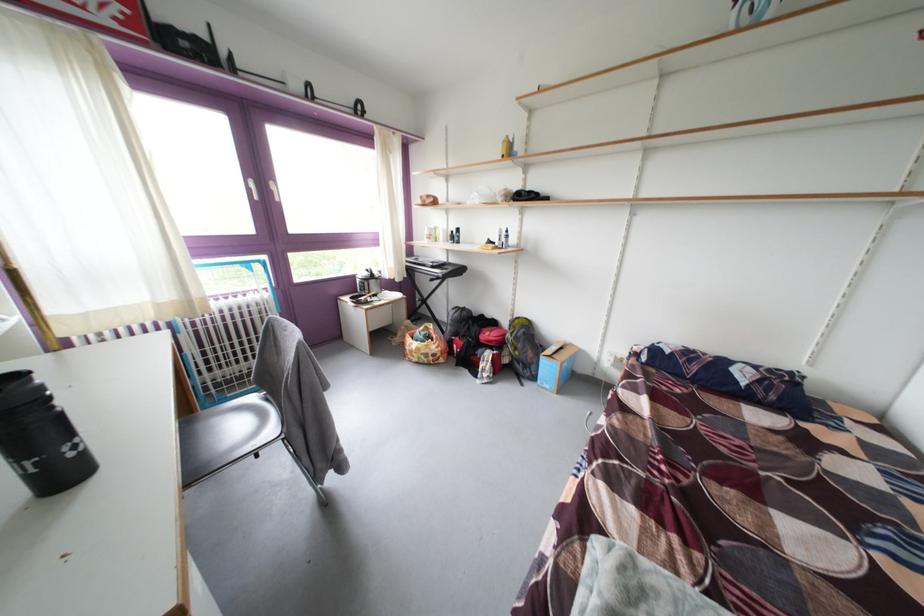
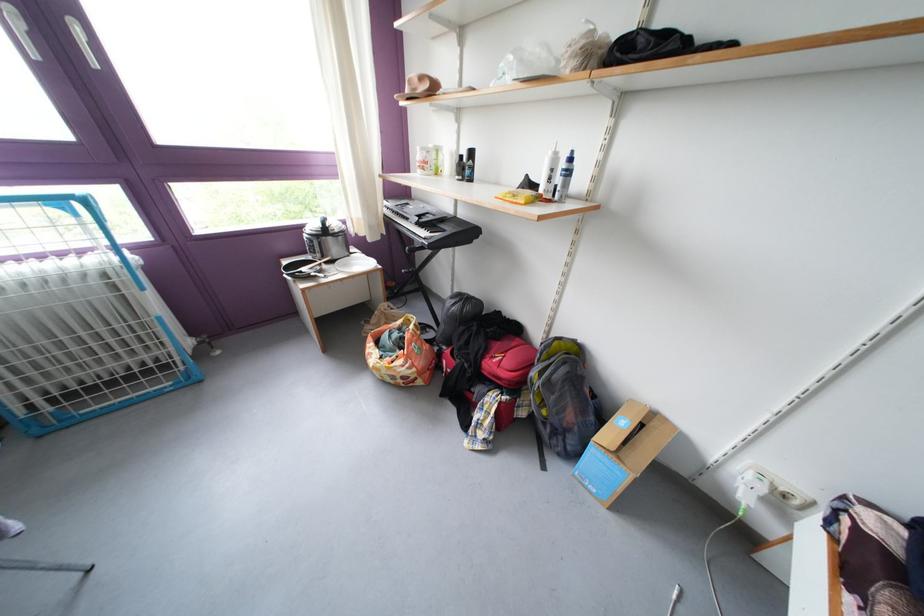
Locate, in the second image, the point that corresponds to the point at 517,341 in the first image.

(543, 379)